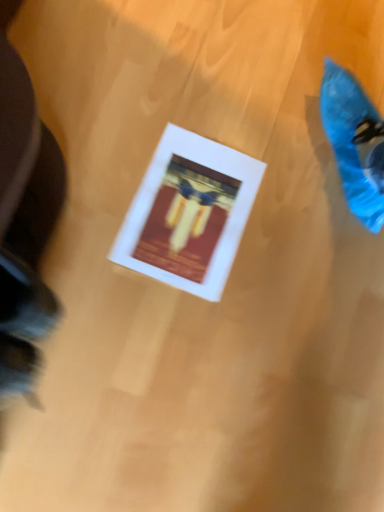
Locate an element on the screen. empty space that is ontop of white matte picture frame at center is located at coordinates (189, 210).